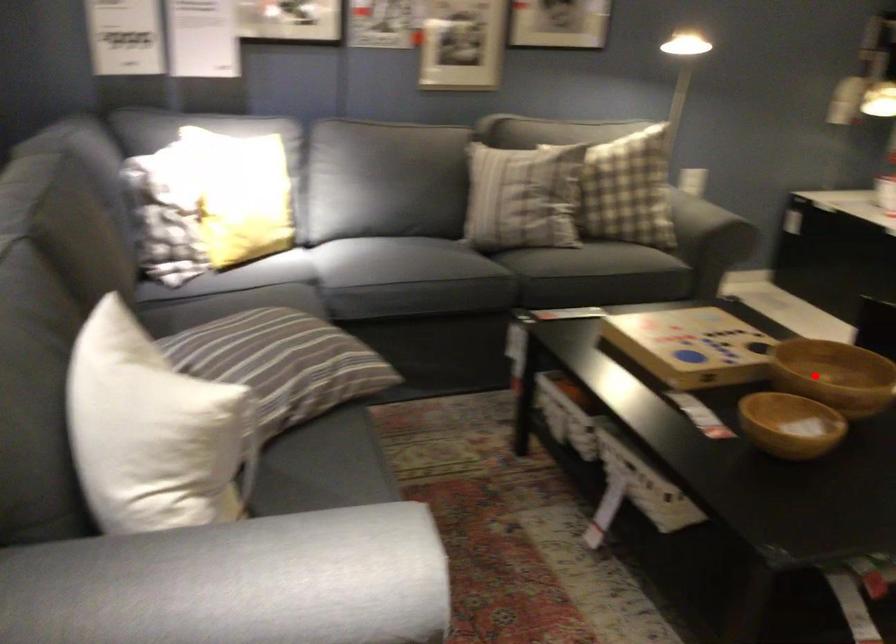
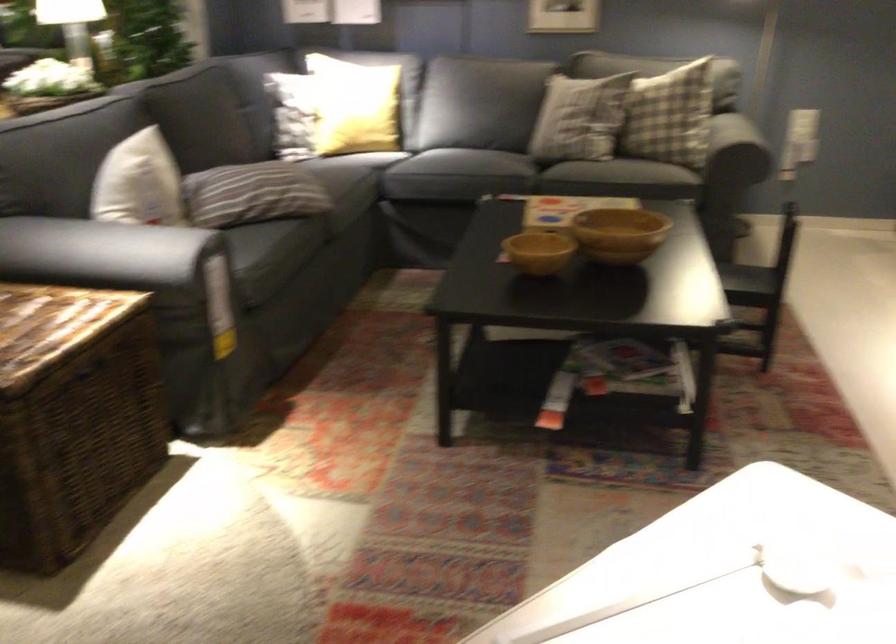
Where in the second image is the point corresponding to the highlighted location from the first image?

(618, 234)